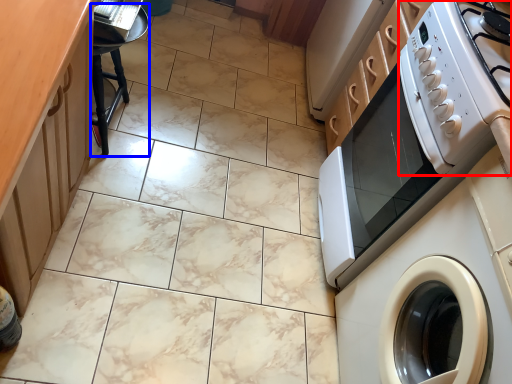
Question: Which object appears closest to the camera in this image, gas stove (highlighted by a red box) or bar stool (highlighted by a blue box)?

Choices:
 (A) gas stove
 (B) bar stool

Answer: (A)